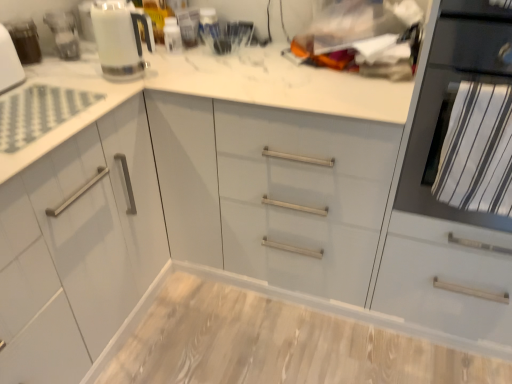
Question: Is black matte oven at right at the back of matte white kettle at upper left?

Choices:
 (A) no
 (B) yes

Answer: (A)

Question: Can you confirm if matte white kettle at upper left is shorter than black matte oven at right?

Choices:
 (A) no
 (B) yes

Answer: (B)

Question: Could you tell me if matte white kettle at upper left is turned towards black matte oven at right?

Choices:
 (A) no
 (B) yes

Answer: (B)

Question: Is matte white kettle at upper left not inside black matte oven at right?

Choices:
 (A) no
 (B) yes

Answer: (B)

Question: From the image's perspective, does matte white kettle at upper left appear lower than black matte oven at right?

Choices:
 (A) yes
 (B) no

Answer: (B)

Question: Would you say white glossy kettle at upper left is to the left or to the right of black matte oven at right in the picture?

Choices:
 (A) left
 (B) right

Answer: (A)

Question: From their relative heights in the image, would you say white glossy kettle at upper left is taller or shorter than black matte oven at right?

Choices:
 (A) tall
 (B) short

Answer: (B)

Question: Is point (115, 57) positioned closer to the camera than point (473, 220)?

Choices:
 (A) closer
 (B) farther

Answer: (B)

Question: In terms of width, does white glossy kettle at upper left look wider or thinner when compared to black matte oven at right?

Choices:
 (A) thin
 (B) wide

Answer: (A)

Question: Is matte white kettle at upper left in front of or behind wooden at center in the image?

Choices:
 (A) front
 (B) behind

Answer: (B)

Question: Is matte white kettle at upper left situated inside wooden at center or outside?

Choices:
 (A) inside
 (B) outside

Answer: (B)

Question: Based on their sizes in the image, would you say matte white kettle at upper left is bigger or smaller than wooden at center?

Choices:
 (A) big
 (B) small

Answer: (B)

Question: Considering the relative positions of matte white kettle at upper left and wooden at center in the image provided, is matte white kettle at upper left to the left or to the right of wooden at center?

Choices:
 (A) right
 (B) left

Answer: (B)

Question: Based on their positions, is white glossy kettle at upper left located to the left or right of wooden at center?

Choices:
 (A) right
 (B) left

Answer: (B)

Question: From the image's perspective, is white glossy kettle at upper left positioned above or below wooden at center?

Choices:
 (A) above
 (B) below

Answer: (A)